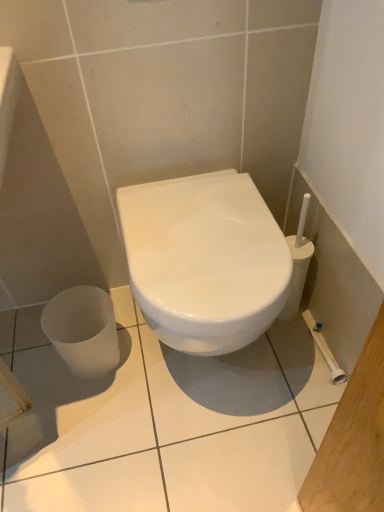
Question: Is white glossy toilet at center shorter than white glossy ceramic tile at center?

Choices:
 (A) no
 (B) yes

Answer: (A)

Question: Is white glossy toilet at center oriented towards white glossy ceramic tile at center?

Choices:
 (A) no
 (B) yes

Answer: (A)

Question: Can you confirm if white glossy toilet at center is smaller than white glossy ceramic tile at center?

Choices:
 (A) no
 (B) yes

Answer: (A)

Question: Considering the relative sizes of white glossy toilet at center and white glossy ceramic tile at center in the image provided, is white glossy toilet at center thinner than white glossy ceramic tile at center?

Choices:
 (A) no
 (B) yes

Answer: (B)

Question: Are white glossy toilet at center and white glossy ceramic tile at center located far from each other?

Choices:
 (A) no
 (B) yes

Answer: (A)

Question: Can you confirm if white glossy toilet at center is positioned to the left of white glossy ceramic tile at center?

Choices:
 (A) no
 (B) yes

Answer: (A)

Question: Is white glossy toilet at center inside white glossy ceramic tile at center?

Choices:
 (A) no
 (B) yes

Answer: (A)

Question: Is white glossy ceramic tile at center completely or partially outside of white glossy toilet at center?

Choices:
 (A) yes
 (B) no

Answer: (A)

Question: From a real-world perspective, is white glossy ceramic tile at center positioned under white glossy toilet at center based on gravity?

Choices:
 (A) no
 (B) yes

Answer: (B)

Question: Is white glossy ceramic tile at center shorter than white glossy toilet at center?

Choices:
 (A) no
 (B) yes

Answer: (B)

Question: Does white glossy ceramic tile at center come behind white glossy toilet at center?

Choices:
 (A) no
 (B) yes

Answer: (B)

Question: Does white glossy ceramic tile at center have a smaller size compared to white glossy toilet at center?

Choices:
 (A) no
 (B) yes

Answer: (B)

Question: From a real-world perspective, relative to white glossy ceramic tile at center, is white glossy toilet at center vertically above or below?

Choices:
 (A) below
 (B) above

Answer: (B)